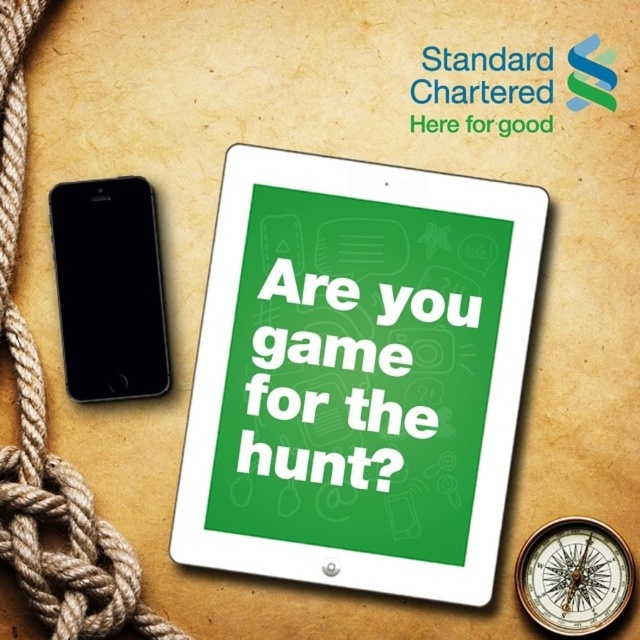
Does green glossy tablet at center appear over black glass smartphone at left?

Incorrect, green glossy tablet at center is not positioned above black glass smartphone at left.

Can you confirm if green glossy tablet at center is smaller than black glass smartphone at left?

No, green glossy tablet at center is not smaller than black glass smartphone at left.

At what (x,y) coordinates should I click in order to perform the action: click on green glossy tablet at center. Please return your answer as a coordinate pair (x, y). Looking at the image, I should click on (358, 372).

Between green glossy tablet at center and brown rope at left, which one is positioned higher?

brown rope at left is higher up.

Measure the distance between green glossy tablet at center and camera.

green glossy tablet at center is 60.28 centimeters from camera.

The height and width of the screenshot is (640, 640). Identify the location of green glossy tablet at center. (358, 372).

Can you confirm if brown rope at left is positioned to the right of black glass smartphone at left?

No, brown rope at left is not to the right of black glass smartphone at left.

Between brown rope at left and black glass smartphone at left, which one appears on the left side from the viewer's perspective?

From the viewer's perspective, brown rope at left appears more on the left side.

Which is in front, point (83, 506) or point (131, 268)?

Point (83, 506)

What are the coordinates of `brown rope at left` in the screenshot? It's located at (45, 426).